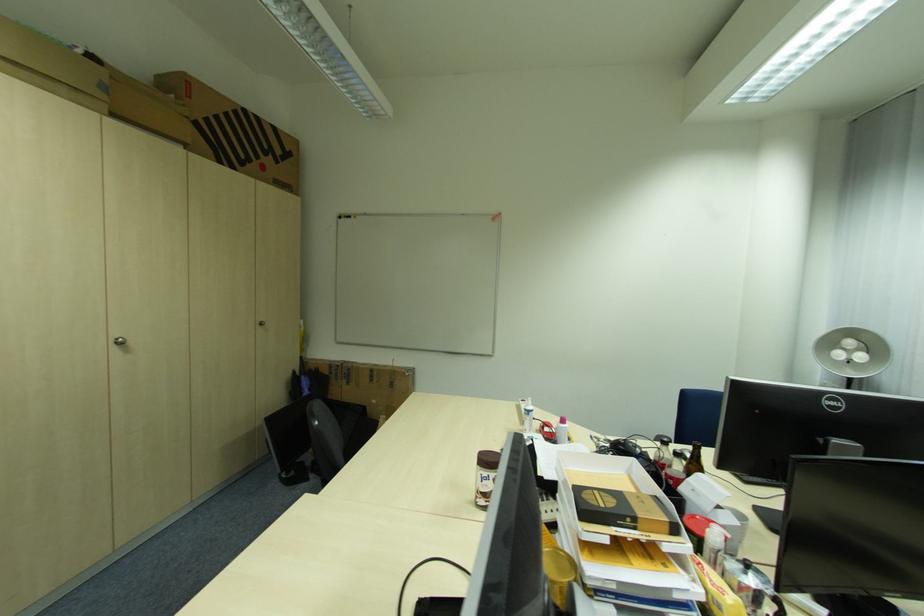
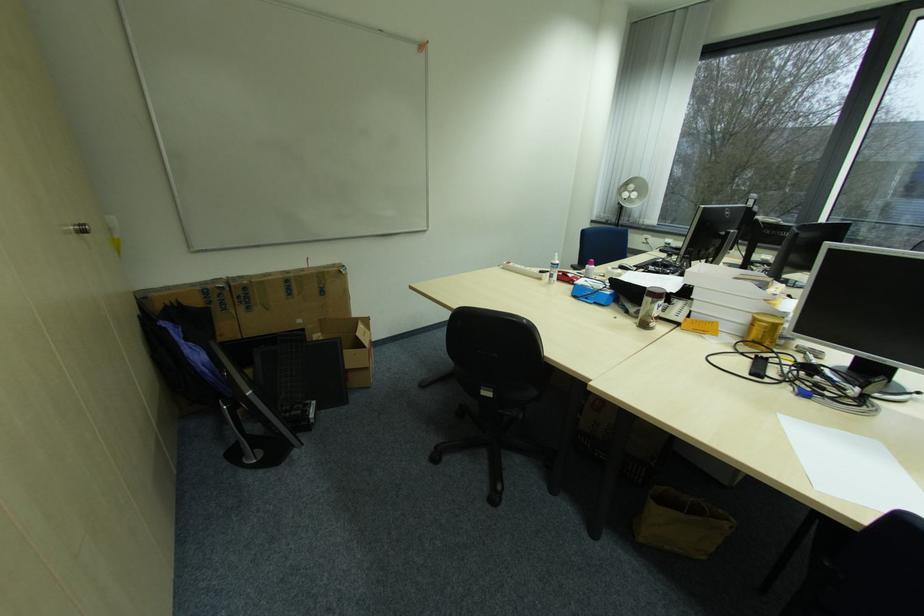
In the second image, find the point that corresponds to the point at 356,383 in the first image.

(257, 309)